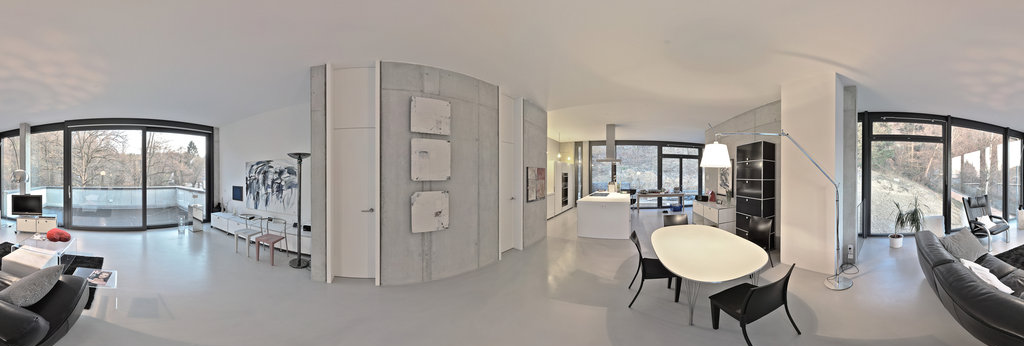
This screenshot has height=346, width=1024. I want to click on table, so click(x=682, y=252).